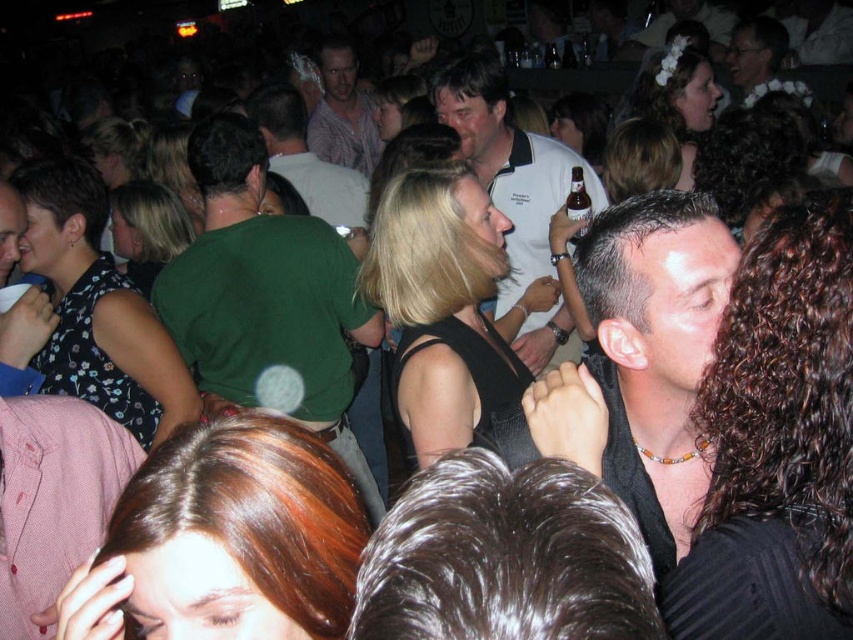
You are standing at the entrance of the bar and want to find the green cotton shirt at center. According to the coordinates, where should you look relative to the entrance?

The green cotton shirt at center is located at coordinates 0.463 on the x axis and 0.313 on the y axis relative to the entrance.

You are at a crowded event and need to pass through the crowd. You see a black matte shirt at center and a green shirt at center. Which path between these two people would allow you to move through more easily?

The path between the black matte shirt at center and the green shirt at center would allow easier movement since the black matte shirt at center is narrower than the green shirt at center, creating a wider gap between them.